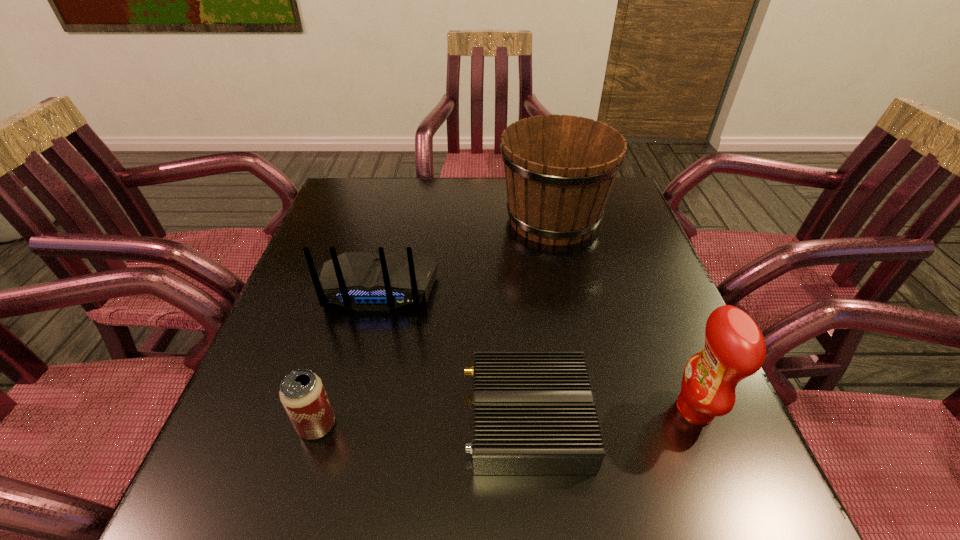
Find the location of a particular element. This screenshot has width=960, height=540. the farthest object is located at coordinates (559, 170).

You are a GUI agent. You are given a task and a screenshot of the screen. Output one action in this format:
    pyautogui.click(x=<x>, y=<y>)
    Task: Click on the condiment
    
    Given the screenshot: What is the action you would take?
    pyautogui.click(x=734, y=349)

At what (x,y) coordinates should I click in order to perform the action: click on the fourth nearest object. Please return your answer as a coordinate pair (x, y). This screenshot has width=960, height=540. Looking at the image, I should click on (363, 281).

Identify the location of the left router. (363, 281).

Where is `the second shortest object`? This screenshot has width=960, height=540. the second shortest object is located at coordinates (302, 394).

Where is `the shortest object`? the shortest object is located at coordinates (533, 411).

The image size is (960, 540). What are the coordinates of `the right router` in the screenshot? It's located at (533, 411).

The width and height of the screenshot is (960, 540). In order to click on vacant space located on the right of the farthest object in this screenshot , I will do click(629, 219).

Locate an element on the screen. This screenshot has height=540, width=960. vacant space located on the label side of the condiment is located at coordinates (576, 409).

This screenshot has height=540, width=960. I want to click on free point located on the label side of the condiment, so click(641, 409).